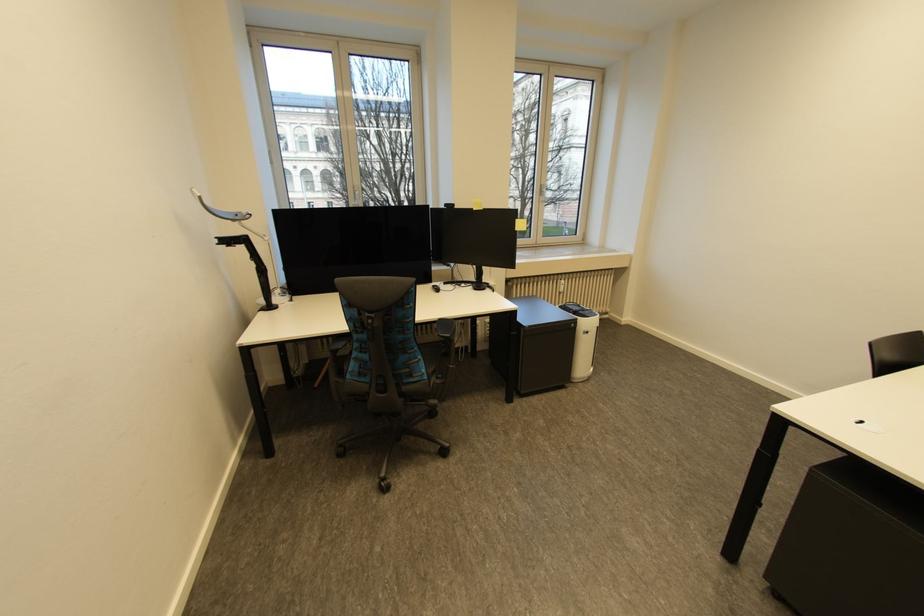
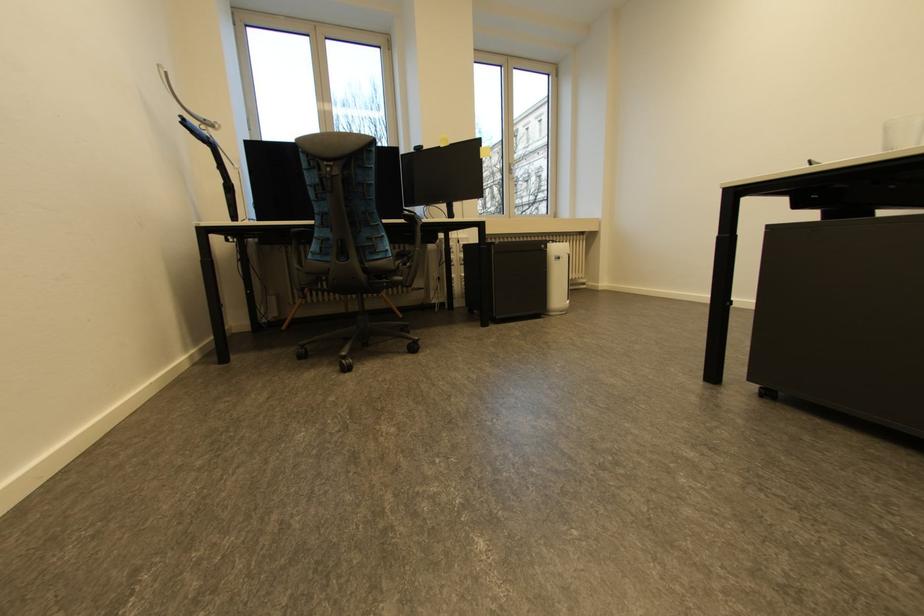
Question: Based on the continuous images, in which direction is the camera rotating? Reply with the corresponding letter.

Choices:
 (A) Left
 (B) Right
 (C) Up
 (D) Down

Answer: (C)